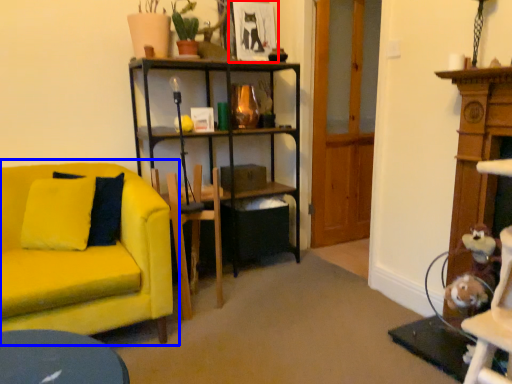
Question: Which object is further to the camera taking this photo, picture frame (highlighted by a red box) or studio couch (highlighted by a blue box)?

Choices:
 (A) picture frame
 (B) studio couch

Answer: (A)